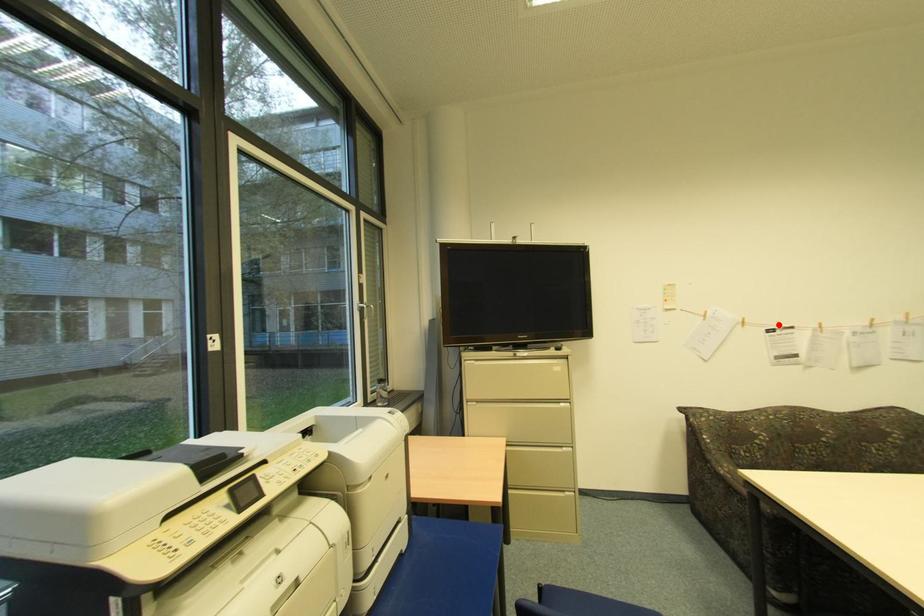
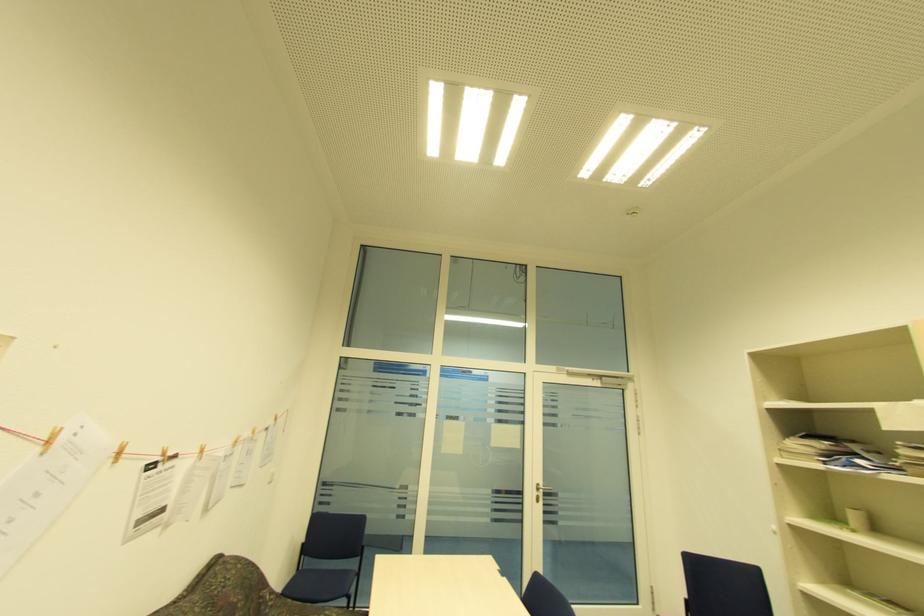
The point at the highlighted location is marked in the first image. Where is the corresponding point in the second image?

(163, 454)